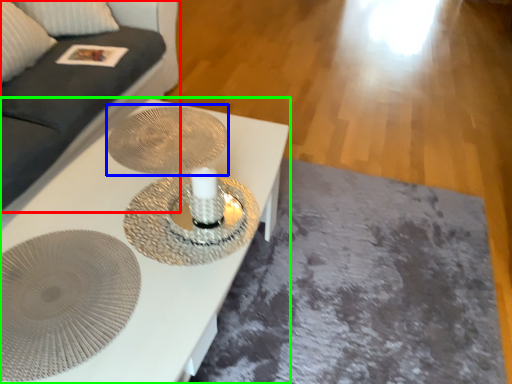
Question: Which object is positioned farthest from couch (highlighted by a red box)? Select from oval (highlighted by a blue box) and table (highlighted by a green box).

Choices:
 (A) oval
 (B) table

Answer: (B)